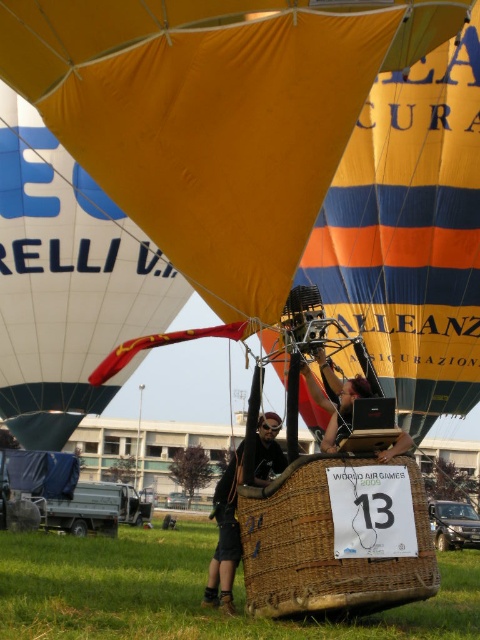
How distant is yellow fabric balloon at upper left from matte black helmet at center?

yellow fabric balloon at upper left is 30.24 meters from matte black helmet at center.

Who is lower down, yellow fabric balloon at upper left or matte black helmet at center?

matte black helmet at center

Where is `yellow fabric balloon at upper left`? Image resolution: width=480 pixels, height=640 pixels. yellow fabric balloon at upper left is located at coordinates (66, 282).

Find the location of a particular element. The height and width of the screenshot is (640, 480). yellow fabric balloon at upper left is located at coordinates (66, 282).

Can you confirm if orange fabric balloon at center is shorter than yellow fabric balloon at upper left?

Indeed, orange fabric balloon at center has a lesser height compared to yellow fabric balloon at upper left.

Is point (431, 250) closer to camera compared to point (60, 184)?

Yes, point (431, 250) is closer to viewer.

Image resolution: width=480 pixels, height=640 pixels. I want to click on orange fabric balloon at center, so click(x=410, y=234).

Locate an element on the screen. This screenshot has height=640, width=480. yellow fabric hot air balloon at center is located at coordinates (216, 115).

Is yellow fabric hot air balloon at center bigger than woven wicker basket at center?

Correct, yellow fabric hot air balloon at center is larger in size than woven wicker basket at center.

You are a GUI agent. You are given a task and a screenshot of the screen. Output one action in this format:
    pyautogui.click(x=<x>, y=<y>)
    Task: Click on the yellow fabric hot air balloon at center
    
    Given the screenshot: What is the action you would take?
    pyautogui.click(x=216, y=115)